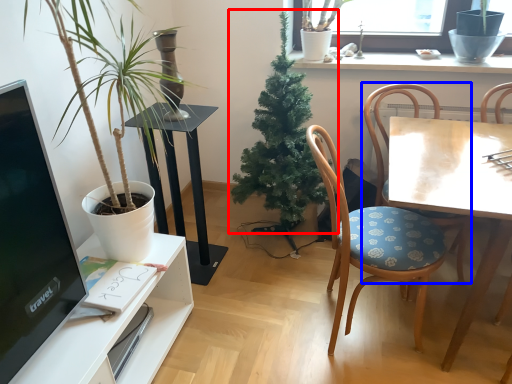
Question: Which object appears closest to the camera in this image, houseplant (highlighted by a red box) or chair (highlighted by a blue box)?

Choices:
 (A) houseplant
 (B) chair

Answer: (B)